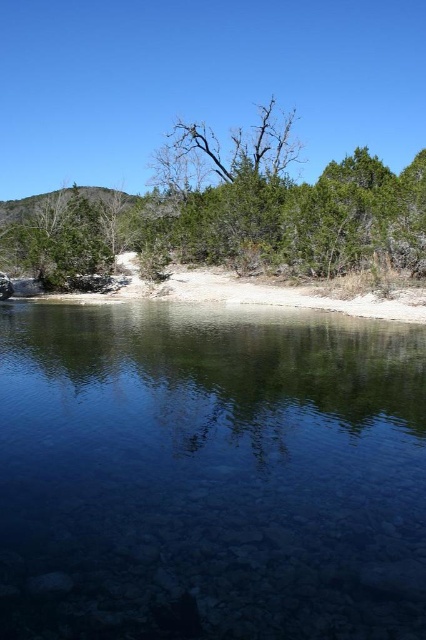
Question: Which point is closer to the camera taking this photo?

Choices:
 (A) (284, 134)
 (B) (256, 449)
 (C) (241, 212)

Answer: (B)

Question: From the image, what is the correct spatial relationship of clear glassy water at center in relation to brown/dry wood tree at upper center?

Choices:
 (A) left
 (B) right

Answer: (B)

Question: Which point appears closest to the camera in this image?

Choices:
 (A) (229, 545)
 (B) (164, 163)
 (C) (396, 266)

Answer: (A)

Question: Is brown/dry wood tree at upper center to the right of bare branches at center from the viewer's perspective?

Choices:
 (A) yes
 (B) no

Answer: (B)

Question: Among these objects, which one is nearest to the camera?

Choices:
 (A) clear glassy water at center
 (B) bare branches at center
 (C) brown/dry wood tree at upper center

Answer: (A)

Question: Is clear glassy water at center bigger than brown/dry wood tree at upper center?

Choices:
 (A) yes
 (B) no

Answer: (B)